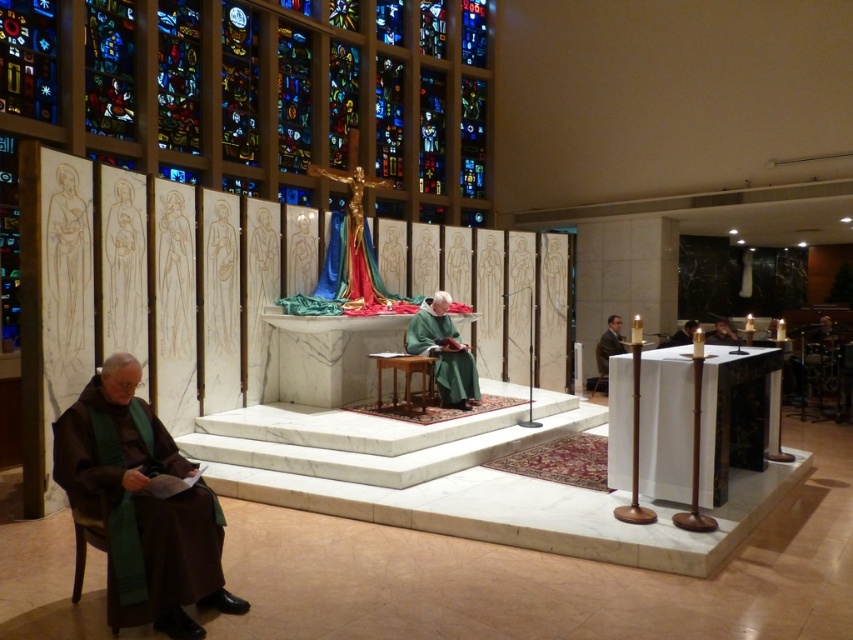
Does point (108, 476) lie in front of point (720, 332)?

Yes, point (108, 476) is in front of point (720, 332).

Can you confirm if brown woolen robe at lower left is positioned above matte black face at right?

Incorrect, brown woolen robe at lower left is not positioned above matte black face at right.

Which is in front, point (160, 531) or point (728, 333)?

Point (160, 531) is in front.

Locate an element on the screen. This screenshot has height=640, width=853. brown woolen robe at lower left is located at coordinates (141, 506).

Does green velvet robe at center have a lesser height compared to matte black face at right?

No, green velvet robe at center is not shorter than matte black face at right.

Can you confirm if green velvet robe at center is bigger than matte black face at right?

Correct, green velvet robe at center is larger in size than matte black face at right.

Locate an element on the screen. The height and width of the screenshot is (640, 853). green velvet robe at center is located at coordinates (444, 352).

Can you confirm if green velvet robe at center is positioned to the left of brown leather jacket at right?

Indeed, green velvet robe at center is positioned on the left side of brown leather jacket at right.

What do you see at coordinates (444, 352) in the screenshot?
I see `green velvet robe at center` at bounding box center [444, 352].

Locate an element on the screen. The image size is (853, 640). green velvet robe at center is located at coordinates (444, 352).